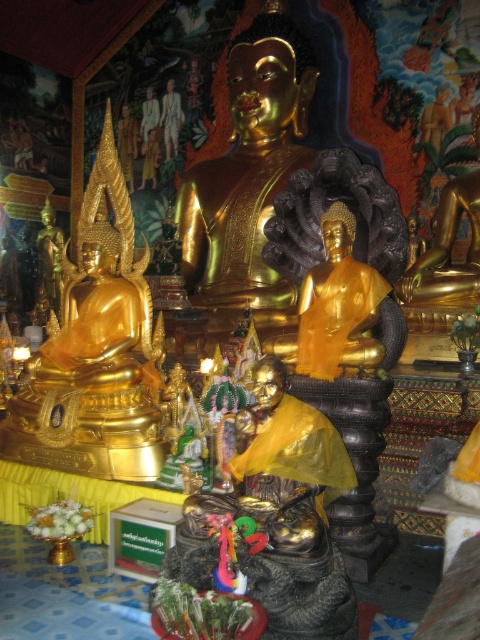
Question: Is gold/yellow fabric draped statue at center to the right of gold polished statue at right from the viewer's perspective?

Choices:
 (A) yes
 (B) no

Answer: (B)

Question: Is gold polished statue at left thinner than gold polished statue at right?

Choices:
 (A) yes
 (B) no

Answer: (B)

Question: Which is farther from the gold polished statue at right?

Choices:
 (A) gold polished statue at left
 (B) gold/yellow fabric draped statue at center

Answer: (B)

Question: Does gold polished statue at left have a larger size compared to gold/yellow fabric draped statue at center?

Choices:
 (A) no
 (B) yes

Answer: (B)

Question: Among these objects, which one is farthest from the camera?

Choices:
 (A) gold/yellow fabric draped statue at center
 (B) gold shiny statue at center
 (C) gold polished statue at right
 (D) gold polished statue at left

Answer: (C)

Question: Among these points, which one is farthest from the camera?

Choices:
 (A) (326, 320)
 (B) (66, 364)
 (C) (344, 614)

Answer: (B)